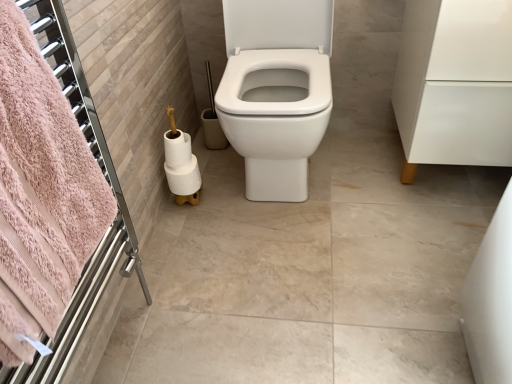
Question: Is white matte toilet paper at lower left, positioned as the 2th toilet paper in bottom-to-top order, facing towards white matte toilet paper at lower left, which is the 1th toilet paper from top to bottom?

Choices:
 (A) yes
 (B) no

Answer: (A)

Question: Considering the relative sizes of white matte toilet paper at lower left, positioned as the 2th toilet paper in bottom-to-top order, and white matte toilet paper at lower left, which is the 1th toilet paper from top to bottom, in the image provided, is white matte toilet paper at lower left, positioned as the 2th toilet paper in bottom-to-top order, bigger than white matte toilet paper at lower left, which is the 1th toilet paper from top to bottom,?

Choices:
 (A) yes
 (B) no

Answer: (A)

Question: Is white matte toilet paper at lower left, the second toilet paper from the top, smaller than white matte toilet paper at lower left, positioned as the third toilet paper in bottom-to-top order?

Choices:
 (A) no
 (B) yes

Answer: (A)

Question: Is white matte toilet paper at lower left, positioned as the 2th toilet paper in bottom-to-top order, facing away from white matte toilet paper at lower left, positioned as the third toilet paper in bottom-to-top order?

Choices:
 (A) no
 (B) yes

Answer: (B)

Question: From the image's perspective, is white matte toilet paper at lower left, positioned as the 2th toilet paper in bottom-to-top order, below white matte toilet paper at lower left, positioned as the third toilet paper in bottom-to-top order?

Choices:
 (A) yes
 (B) no

Answer: (A)

Question: From the image's perspective, is white matte toilet paper at lower left, positioned as the 2th toilet paper in bottom-to-top order, positioned above or below white glossy toilet at center?

Choices:
 (A) below
 (B) above

Answer: (A)

Question: In terms of width, does white matte toilet paper at lower left, positioned as the 2th toilet paper in bottom-to-top order, look wider or thinner when compared to white glossy toilet at center?

Choices:
 (A) wide
 (B) thin

Answer: (B)

Question: From a real-world perspective, is white matte toilet paper at lower left, positioned as the 2th toilet paper in bottom-to-top order, above or below white glossy toilet at center?

Choices:
 (A) below
 (B) above

Answer: (A)

Question: Considering the positions of white matte toilet paper at lower left, positioned as the 2th toilet paper in bottom-to-top order, and white glossy toilet at center in the image, is white matte toilet paper at lower left, positioned as the 2th toilet paper in bottom-to-top order, taller or shorter than white glossy toilet at center?

Choices:
 (A) tall
 (B) short

Answer: (B)

Question: From the image's perspective, relative to white matte toilet paper at lower left, positioned as the third toilet paper in top-to-bottom order, is white glossy cabinet at right above or below?

Choices:
 (A) below
 (B) above

Answer: (B)

Question: Is white glossy cabinet at right bigger or smaller than white matte toilet paper at lower left, positioned as the third toilet paper in top-to-bottom order?

Choices:
 (A) big
 (B) small

Answer: (A)

Question: Relative to white matte toilet paper at lower left, positioned as the third toilet paper in top-to-bottom order, is white glossy cabinet at right in front or behind?

Choices:
 (A) front
 (B) behind

Answer: (A)

Question: Looking at their shapes, would you say white glossy cabinet at right is wider or thinner than white matte toilet paper at lower left, positioned as the third toilet paper in top-to-bottom order?

Choices:
 (A) thin
 (B) wide

Answer: (B)

Question: Which is correct: white glossy toilet at center is inside white matte toilet paper at lower left, the second toilet paper from the top, or outside of it?

Choices:
 (A) outside
 (B) inside

Answer: (A)

Question: From the image's perspective, is white glossy toilet at center located above or below white matte toilet paper at lower left, the second toilet paper from the top?

Choices:
 (A) below
 (B) above

Answer: (B)